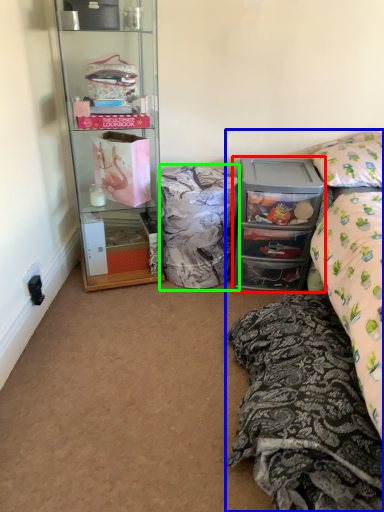
Question: Which is farther away from cabinetry (highlighted by a red box)? bed (highlighted by a blue box) or material (highlighted by a green box)?

Choices:
 (A) bed
 (B) material

Answer: (A)